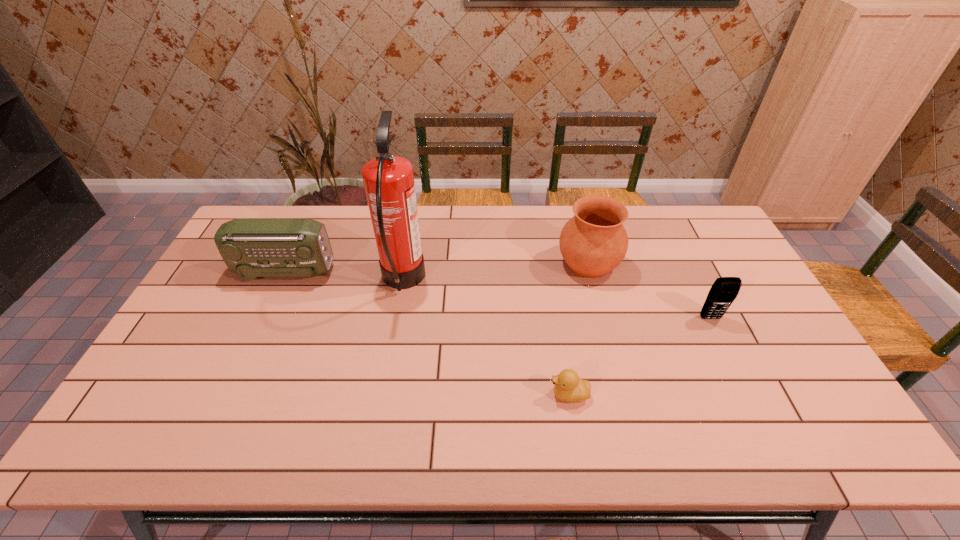
In the image, there is a desktop. Find the location of `free region at the left edge`. free region at the left edge is located at coordinates (228, 284).

Identify the location of vacant area at the right edge. (774, 333).

The image size is (960, 540). I want to click on blank space at the far right corner, so click(x=711, y=232).

Identify the location of free area in between the rightmost object and the fourth object from right to left. The width and height of the screenshot is (960, 540). (557, 300).

Locate an element on the screen. The image size is (960, 540). empty space between the leftmost object and the nearest object is located at coordinates (427, 333).

This screenshot has height=540, width=960. I want to click on free space between the pottery and the leftmost object, so click(437, 267).

You are a GUI agent. You are given a task and a screenshot of the screen. Output one action in this format:
    pyautogui.click(x=<x>, y=<y>)
    Task: Click on the empty location between the fire extinguisher and the nearest object
    The image size is (960, 540).
    Given the screenshot: What is the action you would take?
    pyautogui.click(x=486, y=338)

Identify the location of unoccupied position between the fire extinguisher and the leftmost object. This screenshot has height=540, width=960. (344, 276).

Identify the location of unoccupied area between the pottery and the shortest object. The width and height of the screenshot is (960, 540). (579, 329).

Locate an element on the screen. vacant point located between the radio_receiver and the shortest object is located at coordinates (427, 333).